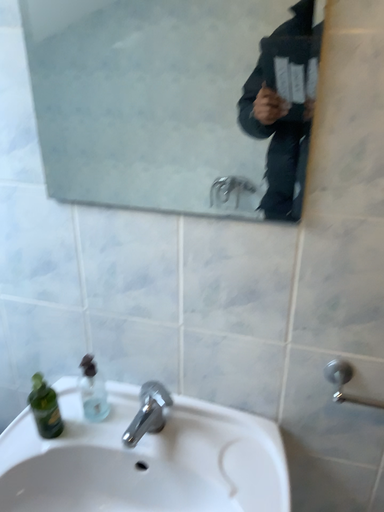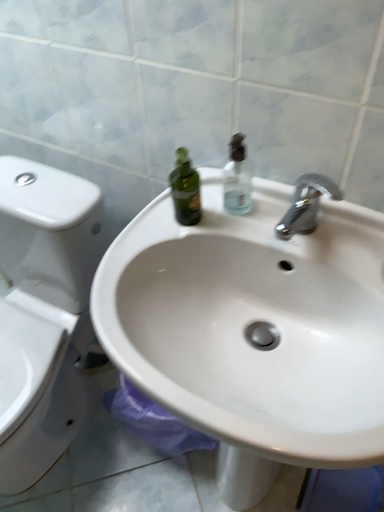
Question: Which way did the camera rotate in the video?

Choices:
 (A) rotated right
 (B) rotated left

Answer: (B)